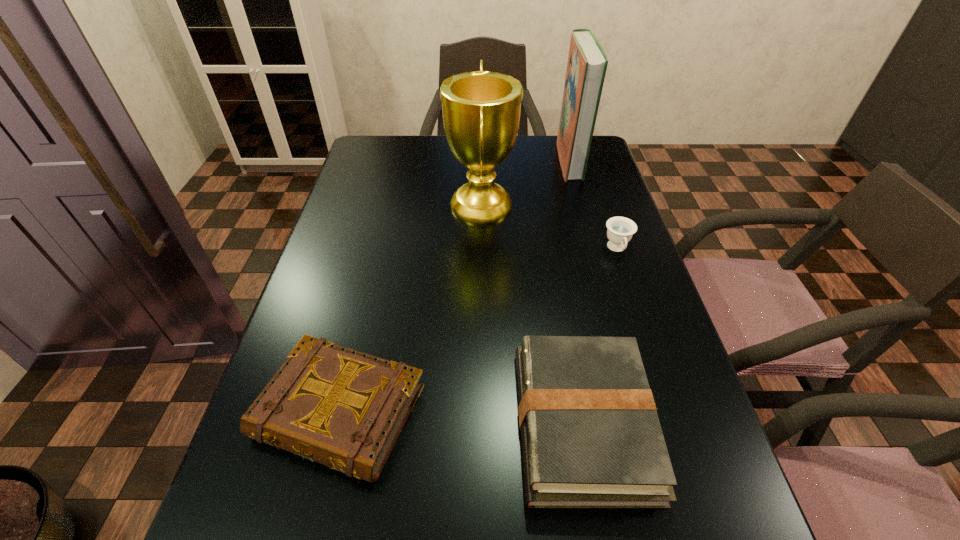
Find the location of a particular element. The width and height of the screenshot is (960, 540). vacant position located on the shiny surface of the award is located at coordinates (358, 206).

The height and width of the screenshot is (540, 960). What are the coordinates of `vacant space situated on the shiny surface of the award` in the screenshot? It's located at (362, 206).

This screenshot has height=540, width=960. Identify the location of free spot located 0.360m on the spine side of the second shortest hardback book. (316, 423).

Where is `free space located on the spine side of the second shortest hardback book`? Image resolution: width=960 pixels, height=540 pixels. free space located on the spine side of the second shortest hardback book is located at coordinates (434, 423).

You are a GUI agent. You are given a task and a screenshot of the screen. Output one action in this format:
    pyautogui.click(x=<x>, y=<y>)
    Task: Click on the free space located on the spine side of the second shortest hardback book
    
    Given the screenshot: What is the action you would take?
    pyautogui.click(x=361, y=423)

Image resolution: width=960 pixels, height=540 pixels. In order to click on vacant space located 0.260m on the side of the teacup with the handle in this screenshot , I will do `click(650, 350)`.

The image size is (960, 540). Find the location of `free space located on the right of the leftmost hardback book`. free space located on the right of the leftmost hardback book is located at coordinates pyautogui.click(x=511, y=412).

You are a GUI agent. You are given a task and a screenshot of the screen. Output one action in this format:
    pyautogui.click(x=<x>, y=<y>)
    Task: Click on the hardback book situated at the far edge
    The height and width of the screenshot is (540, 960).
    Given the screenshot: What is the action you would take?
    pyautogui.click(x=587, y=63)

Find the location of a particular element. The width and height of the screenshot is (960, 540). award positioned at the far edge is located at coordinates (481, 109).

Identify the location of object present at the left edge. point(345,409).